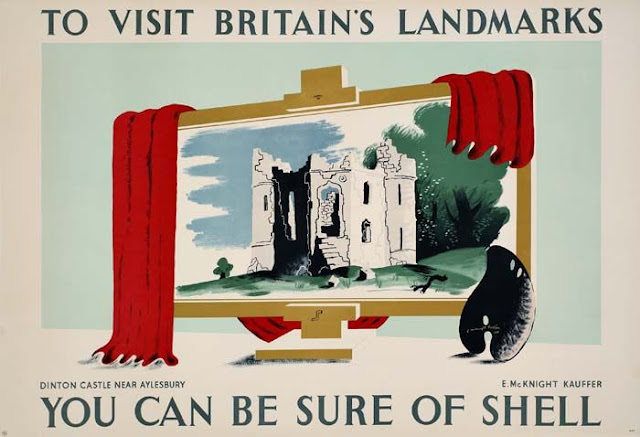
You are a GUI agent. You are given a task and a screenshot of the screen. Output one action in this format:
    pyautogui.click(x=<x>, y=<y>)
    Task: Click on the archway
    This screenshot has width=640, height=437.
    Given the screenshot: What is the action you would take?
    pyautogui.click(x=326, y=208)